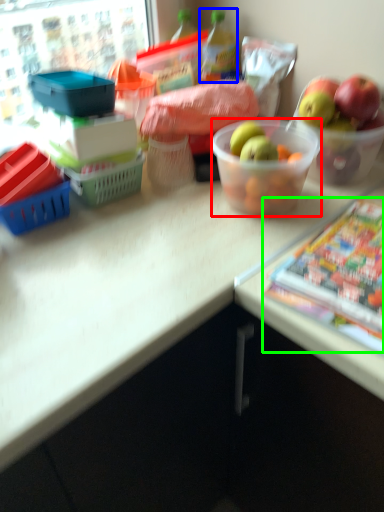
Question: Which is nearer to the bowl (highlighted by a red box)? bottle (highlighted by a blue box) or comic book (highlighted by a green box).

Choices:
 (A) bottle
 (B) comic book

Answer: (B)